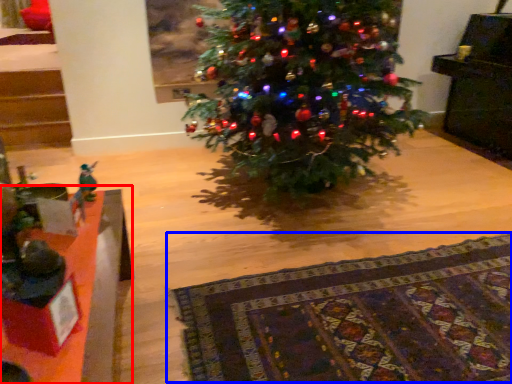
Question: Which object is further to the camera taking this photo, table (highlighted by a red box) or blanket (highlighted by a blue box)?

Choices:
 (A) table
 (B) blanket

Answer: (B)